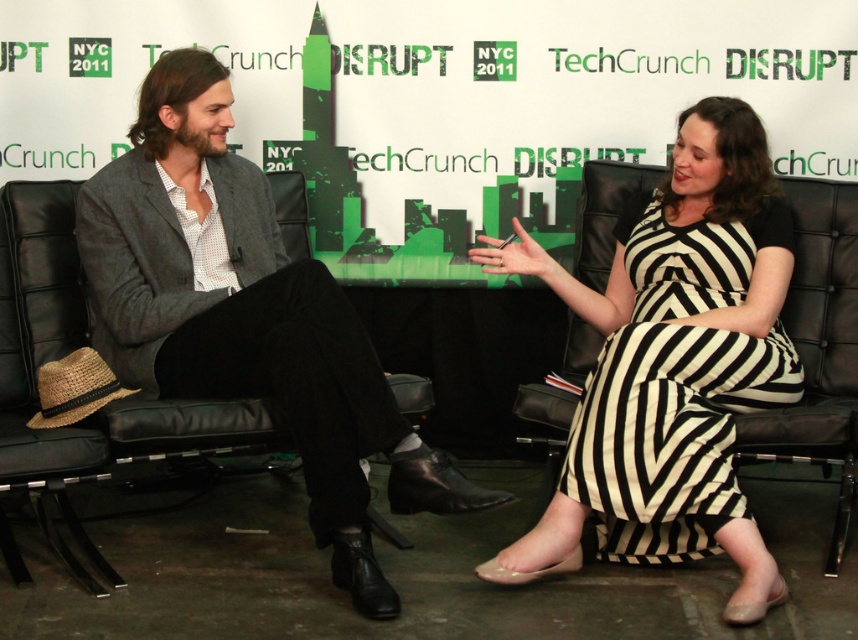
Between point (336, 406) and point (759, 360), which one is positioned in front?

Point (336, 406)

Consider the image. Between matte gray blazer at center and black and white striped dress at center, which one appears on the left side from the viewer's perspective?

matte gray blazer at center is more to the left.

Locate an element on the screen. The height and width of the screenshot is (640, 858). matte gray blazer at center is located at coordinates (246, 316).

The image size is (858, 640). I want to click on matte gray blazer at center, so click(246, 316).